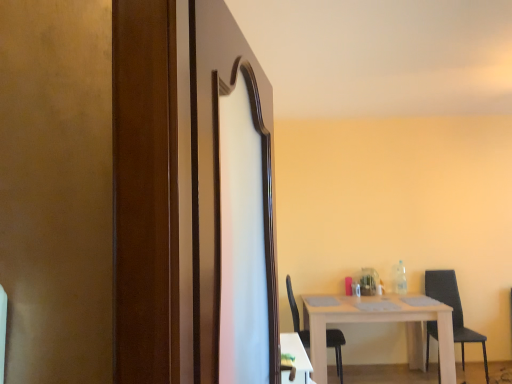
I want to click on black matte chair at lower right, positioned as the second chair in right-to-left order, so click(336, 348).

The height and width of the screenshot is (384, 512). What do you see at coordinates (381, 322) in the screenshot?
I see `white wooden table at center, positioned as the 1th table in back-to-front order` at bounding box center [381, 322].

I want to click on wooden screen door at center, so click(x=230, y=196).

In order to face wooden screen door at center, should I rotate leftwards or rightwards?

To face it directly, rotate left by 0.732 degrees.

Measure the distance between point (300,376) and camera.

The depth of point (300,376) is 7.81 feet.

What do you see at coordinates (295, 359) in the screenshot?
I see `white glossy table at lower right, marked as the second table in a back-to-front arrangement` at bounding box center [295, 359].

What is the approximate width of black fabric chair at right, which is the 1th chair in right-to-left order?

The width of black fabric chair at right, which is the 1th chair in right-to-left order, is 22.05 inches.

Identify the location of black matte chair at lower right, positioned as the second chair in right-to-left order. (336, 348).

Considering the sizes of objects white glossy table at lower right, the 1th table viewed from the left, and white wooden table at center, positioned as the 1th table in back-to-front order, in the image provided, who is bigger, white glossy table at lower right, the 1th table viewed from the left, or white wooden table at center, positioned as the 1th table in back-to-front order,?

Bigger between the two is white wooden table at center, positioned as the 1th table in back-to-front order.

From the picture: Which is more to the left, white glossy table at lower right, the 1th table when ordered from front to back, or white wooden table at center, positioned as the 1th table in right-to-left order?

Positioned to the left is white glossy table at lower right, the 1th table when ordered from front to back.

From a real-world perspective, which object stands above the other?

In real-world perspective, white glossy table at lower right, which is the 2th table in right-to-left order, is above.

Is wooden screen door at center completely or partially inside black matte chair at lower right, positioned as the second chair in right-to-left order?

That's incorrect, wooden screen door at center is not inside black matte chair at lower right, positioned as the second chair in right-to-left order.

Which object is closer to the camera, black matte chair at lower right, positioned as the second chair in right-to-left order, or wooden screen door at center?

wooden screen door at center.

How different are the orientations of black matte chair at lower right, the 1th chair when ordered from left to right, and wooden screen door at center in degrees?

The angle between the facing direction of black matte chair at lower right, the 1th chair when ordered from left to right, and the facing direction of wooden screen door at center is 5.01 degrees.

Looking at this image, from the image's perspective, is black matte chair at lower right, positioned as the second chair in right-to-left order, below wooden screen door at center?

Yes.

Between black fabric chair at right, which is the 1th chair in right-to-left order, and black matte chair at lower right, the 1th chair when ordered from left to right, which one appears on the right side from the viewer's perspective?

black fabric chair at right, which is the 1th chair in right-to-left order, is more to the right.

Between black fabric chair at right, positioned as the second chair in left-to-right order, and black matte chair at lower right, the 1th chair when ordered from left to right, which one has less height?

black fabric chair at right, positioned as the second chair in left-to-right order, is shorter.

Is black fabric chair at right, positioned as the second chair in left-to-right order, turned away from black matte chair at lower right, positioned as the second chair in right-to-left order?

That's not correct — black fabric chair at right, positioned as the second chair in left-to-right order, is not looking away from black matte chair at lower right, positioned as the second chair in right-to-left order.

Is white wooden table at center, positioned as the 1th table in back-to-front order, looking in the opposite direction of black fabric chair at right, positioned as the second chair in left-to-right order?

No, black fabric chair at right, positioned as the second chair in left-to-right order, is not at the back of white wooden table at center, positioned as the 1th table in back-to-front order.

Where is `chair that is the 2nd object located above the white wooden table at center, positioned as the 1th table in right-to-left order (from the image's perspective)`? The height and width of the screenshot is (384, 512). chair that is the 2nd object located above the white wooden table at center, positioned as the 1th table in right-to-left order (from the image's perspective) is located at coordinates (453, 309).

Is point (398, 302) closer to camera compared to point (426, 283)?

Yes, it is in front of point (426, 283).

Does white wooden table at center, which is counted as the 2th table, starting from the left, appear on the left side of white glossy table at lower right, the 1th table when ordered from front to back?

In fact, white wooden table at center, which is counted as the 2th table, starting from the left, is to the right of white glossy table at lower right, the 1th table when ordered from front to back.

From the picture: What's the angular difference between white wooden table at center, positioned as the 1th table in right-to-left order, and white glossy table at lower right, the 1th table when ordered from front to back,'s facing directions?

The angular difference between white wooden table at center, positioned as the 1th table in right-to-left order, and white glossy table at lower right, the 1th table when ordered from front to back, is 90.4 degrees.

How far apart are white wooden table at center, positioned as the 1th table in back-to-front order, and white glossy table at lower right, which is the 2th table in right-to-left order?

white wooden table at center, positioned as the 1th table in back-to-front order, and white glossy table at lower right, which is the 2th table in right-to-left order, are 1.09 meters apart.

Based on the photo, can you confirm if white wooden table at center, positioned as the 1th table in back-to-front order, is shorter than white glossy table at lower right, the 1th table when ordered from front to back?

Incorrect, the height of white wooden table at center, positioned as the 1th table in back-to-front order, does not fall short of that of white glossy table at lower right, the 1th table when ordered from front to back.

Which object is thinner, white glossy table at lower right, the 1th table when ordered from front to back, or black matte chair at lower right, positioned as the second chair in right-to-left order?

white glossy table at lower right, the 1th table when ordered from front to back, is thinner.

Considering the relative sizes of white glossy table at lower right, marked as the second table in a back-to-front arrangement, and black matte chair at lower right, positioned as the second chair in right-to-left order, in the image provided, is white glossy table at lower right, marked as the second table in a back-to-front arrangement, taller than black matte chair at lower right, positioned as the second chair in right-to-left order,?

Incorrect, the height of white glossy table at lower right, marked as the second table in a back-to-front arrangement, is not larger of that of black matte chair at lower right, positioned as the second chair in right-to-left order.

Can we say white glossy table at lower right, marked as the second table in a back-to-front arrangement, lies outside black matte chair at lower right, positioned as the second chair in right-to-left order?

That's correct, white glossy table at lower right, marked as the second table in a back-to-front arrangement, is outside of black matte chair at lower right, positioned as the second chair in right-to-left order.

Is white glossy table at lower right, the 1th table when ordered from front to back, in contact with black matte chair at lower right, positioned as the second chair in right-to-left order?

white glossy table at lower right, the 1th table when ordered from front to back, and black matte chair at lower right, positioned as the second chair in right-to-left order, are not in contact.

In the scene shown: Between black matte chair at lower right, the 1th chair when ordered from left to right, and white glossy table at lower right, the 1th table viewed from the left, which one appears on the right side from the viewer's perspective?

Positioned to the right is black matte chair at lower right, the 1th chair when ordered from left to right.

Could you tell me if black matte chair at lower right, positioned as the second chair in right-to-left order, is facing white glossy table at lower right, marked as the second table in a back-to-front arrangement?

No, black matte chair at lower right, positioned as the second chair in right-to-left order, does not turn towards white glossy table at lower right, marked as the second table in a back-to-front arrangement.

Which object is closer to the camera taking this photo, black matte chair at lower right, positioned as the second chair in right-to-left order, or white glossy table at lower right, the 1th table when ordered from front to back?

white glossy table at lower right, the 1th table when ordered from front to back, is more forward.

This screenshot has width=512, height=384. In order to click on table located underneath the white glossy table at lower right, marked as the second table in a back-to-front arrangement (from a real-world perspective) in this screenshot , I will do `click(381, 322)`.

At what (x,y) coordinates should I click in order to perform the action: click on screen door on the left side of black matte chair at lower right, the 1th chair when ordered from left to right. Please return your answer as a coordinate pair (x, y). Looking at the image, I should click on (230, 196).

Estimate the real-world distances between objects in this image. Which object is closer to wooden screen door at center, white wooden table at center, positioned as the 2th table in front-to-back order, or black matte chair at lower right, the 1th chair when ordered from left to right?

Among the two, white wooden table at center, positioned as the 2th table in front-to-back order, is located nearer to wooden screen door at center.

Based on their spatial positions, is white glossy table at lower right, the 1th table viewed from the left, or black fabric chair at right, positioned as the second chair in left-to-right order, closer to wooden screen door at center?

Among the two, white glossy table at lower right, the 1th table viewed from the left, is located nearer to wooden screen door at center.

Looking at the image, which one is located further to white wooden table at center, positioned as the 1th table in right-to-left order, black fabric chair at right, positioned as the second chair in left-to-right order, or white glossy table at lower right, the 1th table when ordered from front to back?

Among the two, white glossy table at lower right, the 1th table when ordered from front to back, is located further to white wooden table at center, positioned as the 1th table in right-to-left order.

From the picture: When comparing their distances from black matte chair at lower right, the 1th chair when ordered from left to right, does black fabric chair at right, positioned as the second chair in left-to-right order, or white glossy table at lower right, marked as the second table in a back-to-front arrangement, seem closer?

black fabric chair at right, positioned as the second chair in left-to-right order, lies closer to black matte chair at lower right, the 1th chair when ordered from left to right, than the other object.

Which object lies further to the anchor point wooden screen door at center, white wooden table at center, positioned as the 1th table in right-to-left order, or white glossy table at lower right, the 1th table viewed from the left?

white wooden table at center, positioned as the 1th table in right-to-left order, is further to wooden screen door at center.

Consider the image. Based on their spatial positions, is black fabric chair at right, which is the 1th chair in right-to-left order, or white wooden table at center, which is counted as the 2th table, starting from the left, closer to wooden screen door at center?

white wooden table at center, which is counted as the 2th table, starting from the left, is closer to wooden screen door at center.

From the picture: Considering their positions, is wooden screen door at center positioned closer to white wooden table at center, which is counted as the 2th table, starting from the left, than black matte chair at lower right, the 1th chair when ordered from left to right?

black matte chair at lower right, the 1th chair when ordered from left to right, is positioned closer to the anchor white wooden table at center, which is counted as the 2th table, starting from the left.

Which object lies further to the anchor point white glossy table at lower right, which is the 2th table in right-to-left order, black fabric chair at right, which is the 1th chair in right-to-left order, or white wooden table at center, positioned as the 1th table in right-to-left order?

black fabric chair at right, which is the 1th chair in right-to-left order.

The width and height of the screenshot is (512, 384). I want to click on table between white glossy table at lower right, marked as the second table in a back-to-front arrangement, and black fabric chair at right, which is the 1th chair in right-to-left order, so click(381, 322).

At what (x,y) coordinates should I click in order to perform the action: click on table between black matte chair at lower right, the 1th chair when ordered from left to right, and black fabric chair at right, positioned as the second chair in left-to-right order. Please return your answer as a coordinate pair (x, y). Looking at the image, I should click on (381, 322).

Locate an element on the screen. Image resolution: width=512 pixels, height=384 pixels. chair between white glossy table at lower right, marked as the second table in a back-to-front arrangement, and black fabric chair at right, positioned as the second chair in left-to-right order is located at coordinates (336, 348).

The image size is (512, 384). I want to click on table located between wooden screen door at center and white wooden table at center, which is counted as the 2th table, starting from the left, in the depth direction, so click(295, 359).